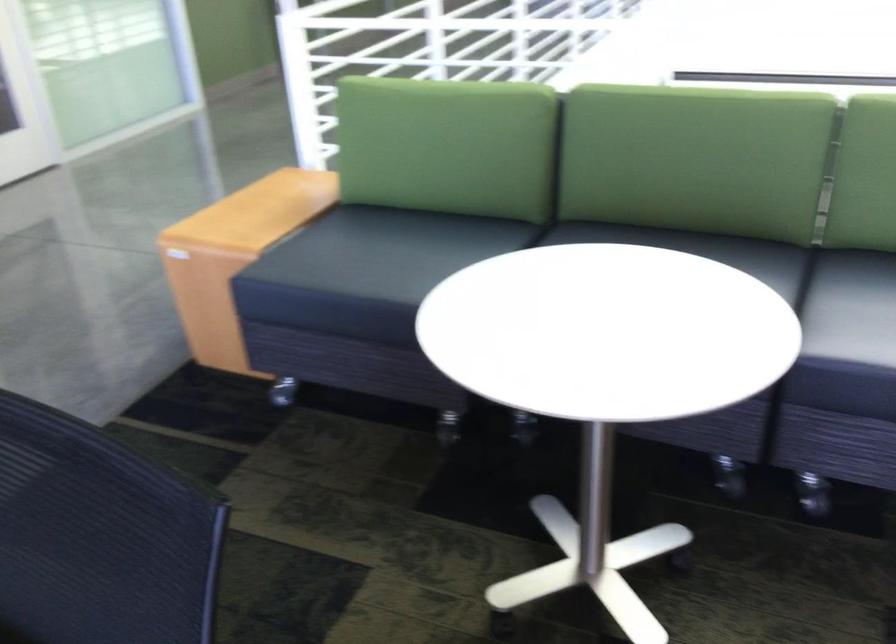
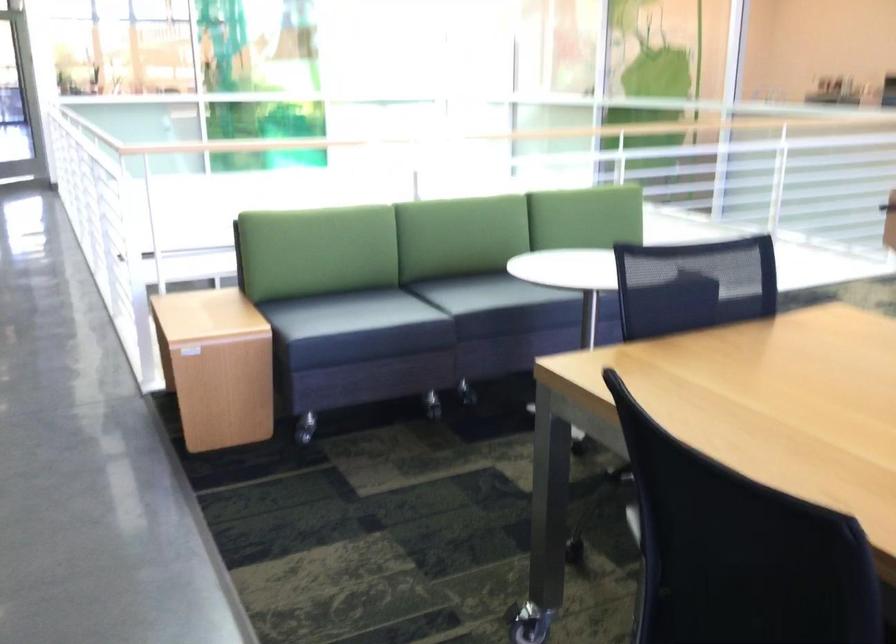
Question: I am providing you with two images of the same scene from different viewpoints. Which of the following objects are not visible in image2?

Choices:
 (A) railing handrail
 (B) black sofa sitting surface
 (C) sofa caster wheel
 (D) red glass bowl

Answer: (B)